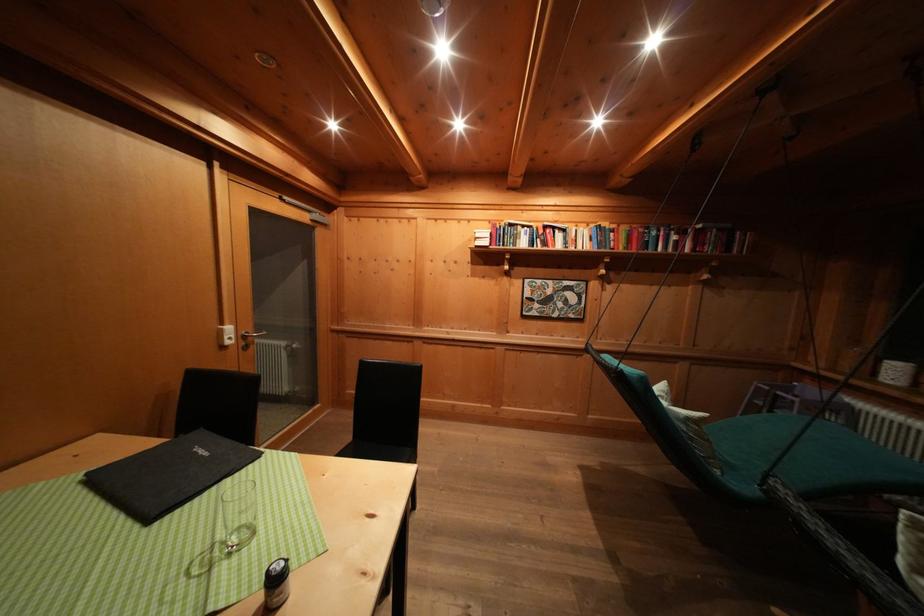
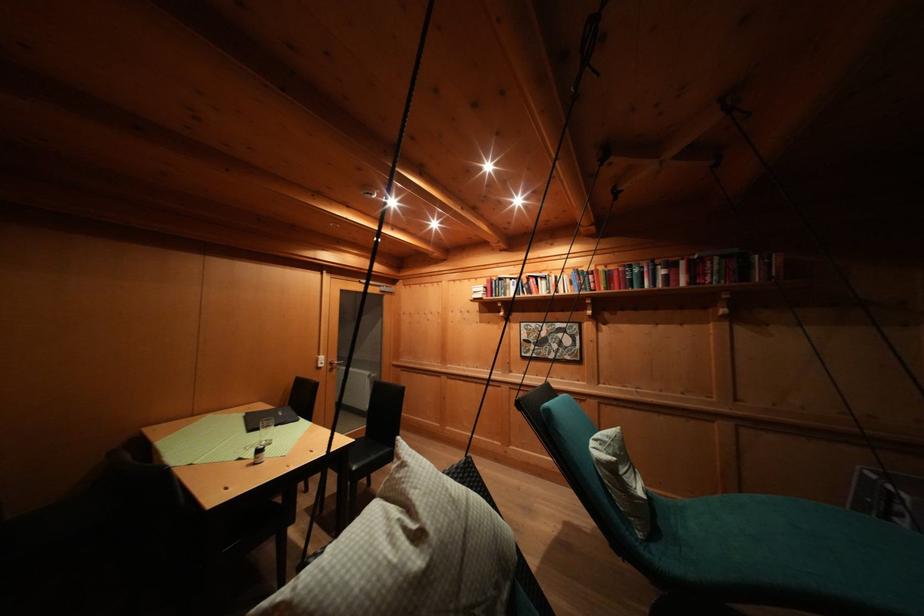
Find the pixel in the second image that matches (159,448) in the first image.

(275, 411)